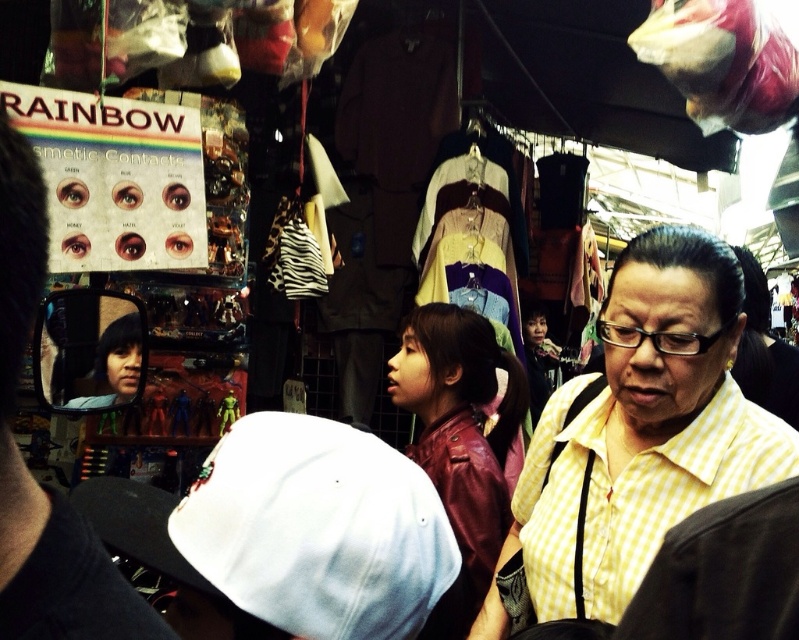
Does yellow checkered shirt at center have a smaller size compared to matte black cap at lower left?

No.

Can you confirm if yellow checkered shirt at center is thinner than matte black cap at lower left?

In fact, yellow checkered shirt at center might be wider than matte black cap at lower left.

Between point (658, 284) and point (2, 595), which one is positioned in front?

Positioned in front is point (2, 595).

Find the location of a particular element. The height and width of the screenshot is (640, 799). yellow checkered shirt at center is located at coordinates (638, 435).

Is yellow checkered shirt at center taller than leather jacket at center?

Yes, yellow checkered shirt at center is taller than leather jacket at center.

What do you see at coordinates (638, 435) in the screenshot?
I see `yellow checkered shirt at center` at bounding box center [638, 435].

In order to click on yellow checkered shirt at center in this screenshot , I will do `click(638, 435)`.

Find the location of `yellow checkered shirt at center`. yellow checkered shirt at center is located at coordinates (638, 435).

Find the location of `matte black cap at lower left`. matte black cap at lower left is located at coordinates (26, 468).

Does point (36, 627) come behind point (523, 385)?

No, it is in front of (523, 385).

Between point (4, 212) and point (404, 328), which one is positioned in front?

Point (4, 212)

Find the location of a particular element. Image resolution: width=799 pixels, height=640 pixels. matte black cap at lower left is located at coordinates (26, 468).